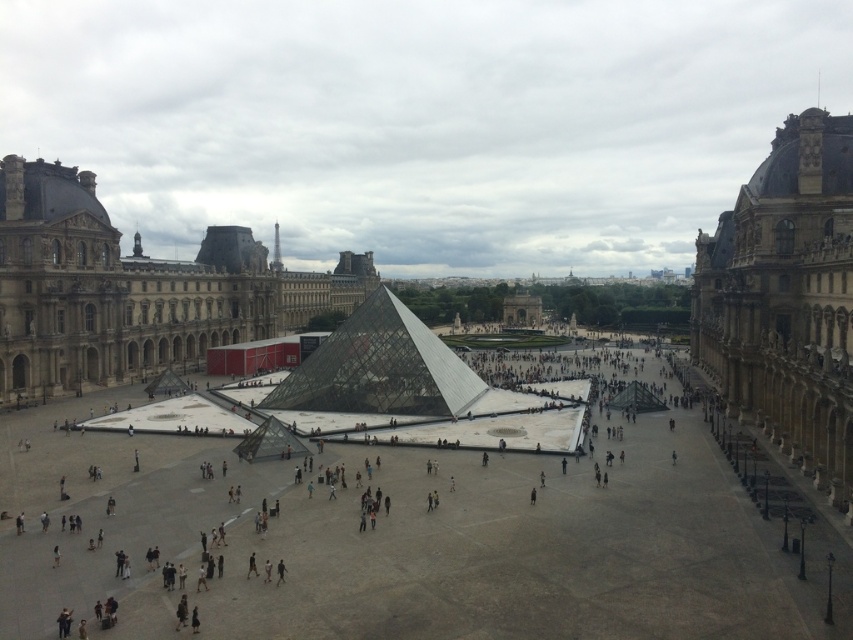
Question: Which object is the closest to the brown stone building at left?

Choices:
 (A) transparent glass pyramid at center
 (B) golden stone palace at right

Answer: (A)

Question: Which point is farther to the camera?

Choices:
 (A) (769, 257)
 (B) (383, 364)

Answer: (B)

Question: Can you confirm if golden stone palace at right is smaller than transparent glass pyramid at center?

Choices:
 (A) no
 (B) yes

Answer: (A)

Question: Is golden stone palace at right closer to the viewer compared to transparent glass pyramid at center?

Choices:
 (A) yes
 (B) no

Answer: (A)

Question: Is golden stone palace at right thinner than transparent glass pyramid at center?

Choices:
 (A) no
 (B) yes

Answer: (B)

Question: Among these objects, which one is farthest from the camera?

Choices:
 (A) brown stone building at left
 (B) golden stone palace at right

Answer: (A)